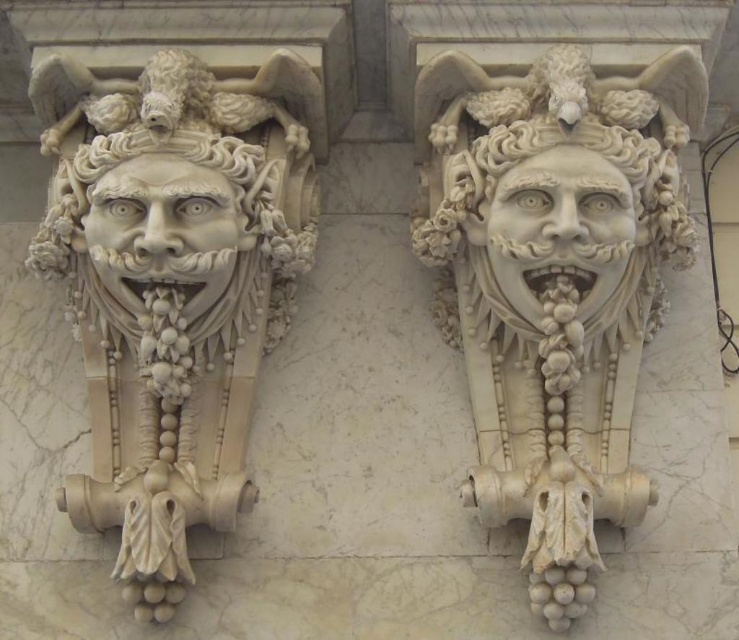
Does white marble mask at center come in front of white marble face at left?

No.

Measure the distance between white marble mask at center and camera.

A distance of 22.59 meters exists between white marble mask at center and camera.

Locate an element on the screen. white marble mask at center is located at coordinates (554, 284).

Who is lower down, white marble mask at left or white marble face at center?

white marble face at center

Which of these two, white marble mask at left or white marble face at center, stands shorter?

Standing shorter between the two is white marble mask at left.

What are the coordinates of `white marble mask at left` in the screenshot? It's located at (173, 284).

Find the location of `white marble mask at left`. white marble mask at left is located at coordinates (173, 284).

Does point (643, 308) come in front of point (619, 220)?

No, (643, 308) is behind (619, 220).

What do you see at coordinates (554, 284) in the screenshot? The width and height of the screenshot is (739, 640). I see `white marble mask at center` at bounding box center [554, 284].

Is point (486, 516) closer to camera compared to point (590, 209)?

No, (486, 516) is behind (590, 209).

Locate an element on the screen. This screenshot has width=739, height=640. white marble mask at center is located at coordinates (554, 284).